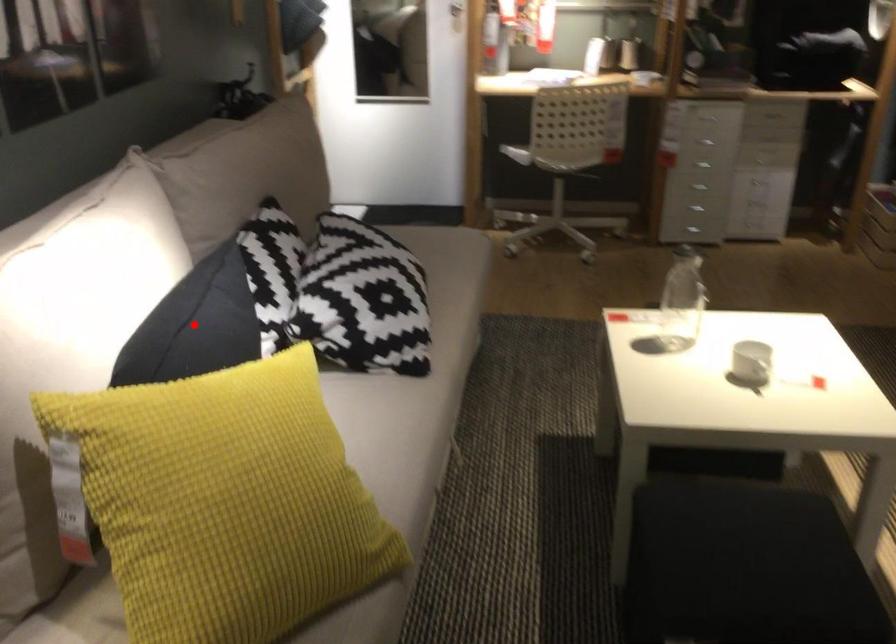
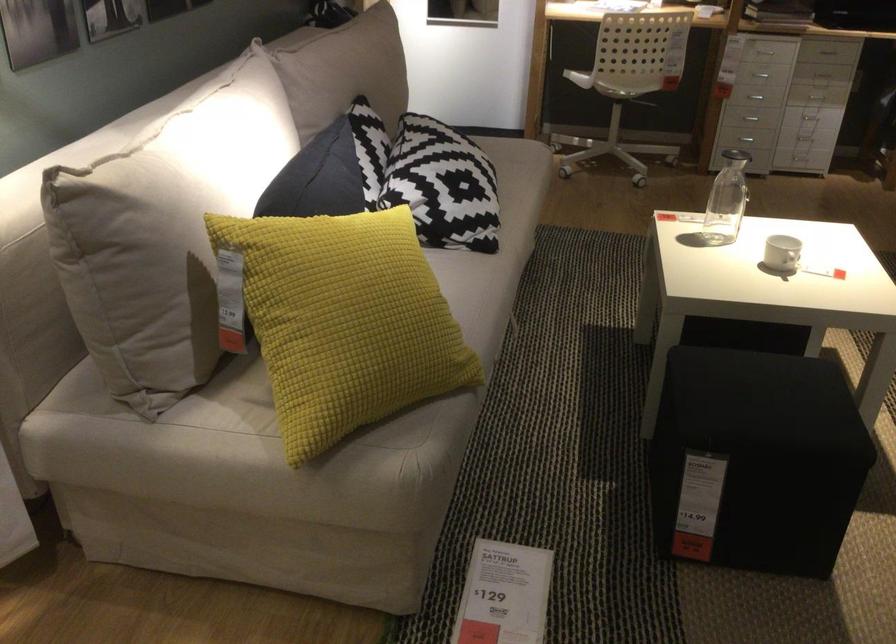
Locate, in the second image, the point that corresponds to the highlighted location in the first image.

(317, 178)